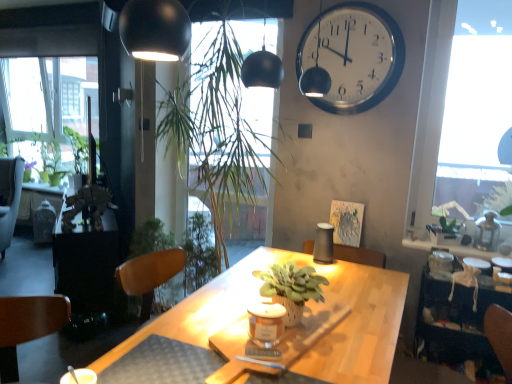
Question: Is green matte plant at center positioned with its back to transparent glass window at upper right?

Choices:
 (A) no
 (B) yes

Answer: (A)

Question: From a real-world perspective, does green matte plant at center stand above transparent glass window at upper right?

Choices:
 (A) yes
 (B) no

Answer: (B)

Question: Does green matte plant at center have a greater height compared to transparent glass window at upper right?

Choices:
 (A) yes
 (B) no

Answer: (B)

Question: Does green matte plant at center appear on the right side of transparent glass window at upper right?

Choices:
 (A) no
 (B) yes

Answer: (A)

Question: Can you confirm if green matte plant at center is thinner than transparent glass window at upper right?

Choices:
 (A) yes
 (B) no

Answer: (B)

Question: Is green matte plant at center further to the viewer compared to transparent glass window at upper right?

Choices:
 (A) yes
 (B) no

Answer: (B)

Question: Would you consider velvet brown armchair at left to be distant from transparent glass window at upper right?

Choices:
 (A) yes
 (B) no

Answer: (A)

Question: Does velvet brown armchair at left have a smaller size compared to transparent glass window at upper right?

Choices:
 (A) yes
 (B) no

Answer: (B)

Question: Can you confirm if velvet brown armchair at left is taller than transparent glass window at upper right?

Choices:
 (A) yes
 (B) no

Answer: (B)

Question: Is velvet brown armchair at left oriented towards transparent glass window at upper right?

Choices:
 (A) no
 (B) yes

Answer: (A)

Question: Does velvet brown armchair at left come behind transparent glass window at upper right?

Choices:
 (A) yes
 (B) no

Answer: (A)

Question: Is velvet brown armchair at left outside transparent glass window at upper right?

Choices:
 (A) yes
 (B) no

Answer: (A)

Question: Is matte glass candle at center further to camera compared to metallic brown table at left, the first table positioned from the left?

Choices:
 (A) no
 (B) yes

Answer: (A)